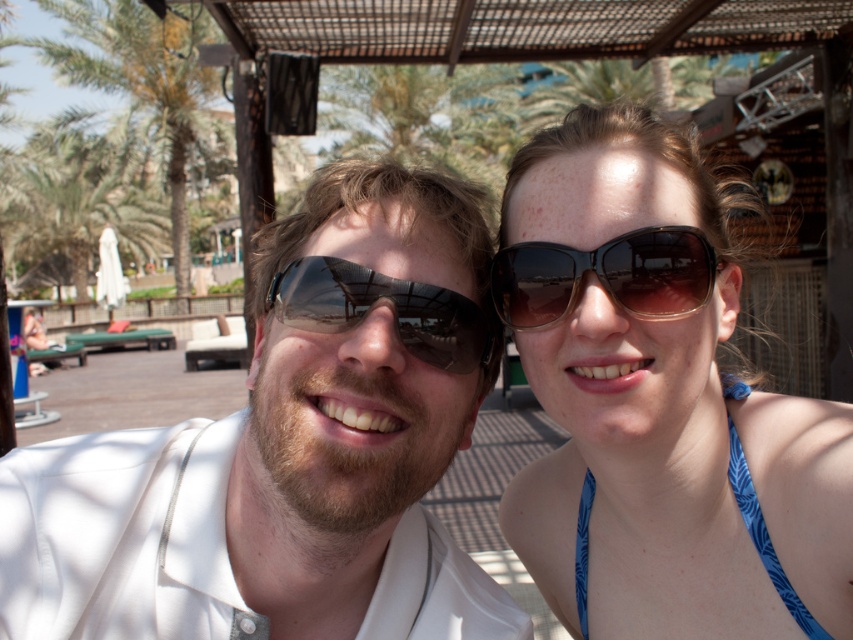
Does point (4, 237) come farther from viewer compared to point (515, 301)?

Yes, point (4, 237) is behind point (515, 301).

Is green leafy palm tree at left above black shiny sunglasses at upper center?

Indeed, green leafy palm tree at left is positioned over black shiny sunglasses at upper center.

Image resolution: width=853 pixels, height=640 pixels. What do you see at coordinates (77, 200) in the screenshot?
I see `green leafy palm tree at left` at bounding box center [77, 200].

What are the coordinates of `green leafy palm tree at left` in the screenshot? It's located at (77, 200).

Who is positioned more to the right, black shiny sunglasses at upper center or blue printed fabric bikini top at upper right?

From the viewer's perspective, blue printed fabric bikini top at upper right appears more on the right side.

Between point (694, 250) and point (808, 616), which one is positioned in front?

Point (694, 250) is more forward.

This screenshot has height=640, width=853. What are the coordinates of `black shiny sunglasses at upper center` in the screenshot? It's located at (605, 275).

Who is positioned more to the right, matte black sunglasses at upper right or green leafy palm tree at left?

matte black sunglasses at upper right

Which is more to the left, matte black sunglasses at upper right or green leafy palm tree at left?

green leafy palm tree at left

Where is `matte black sunglasses at upper right`? matte black sunglasses at upper right is located at coordinates (659, 403).